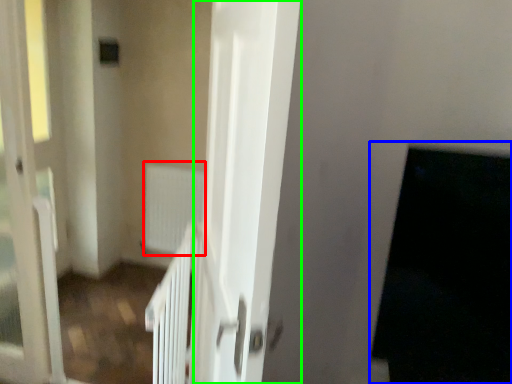
Question: Which object is positioned farthest from radiator (highlighted by a red box)? Select from dark (highlighted by a blue box) and screen door (highlighted by a green box).

Choices:
 (A) dark
 (B) screen door

Answer: (A)